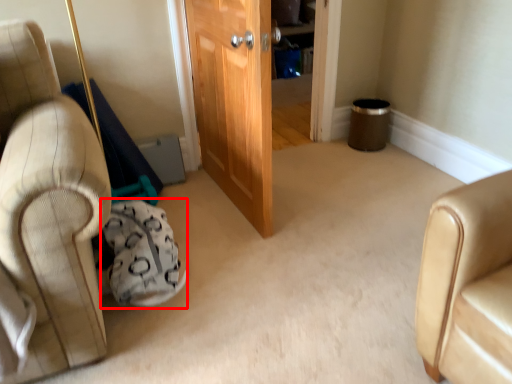
Question: Observing the image, what is the correct spatial positioning of bean bag chair (annotated by the red box) in reference to door?

Choices:
 (A) right
 (B) left

Answer: (B)